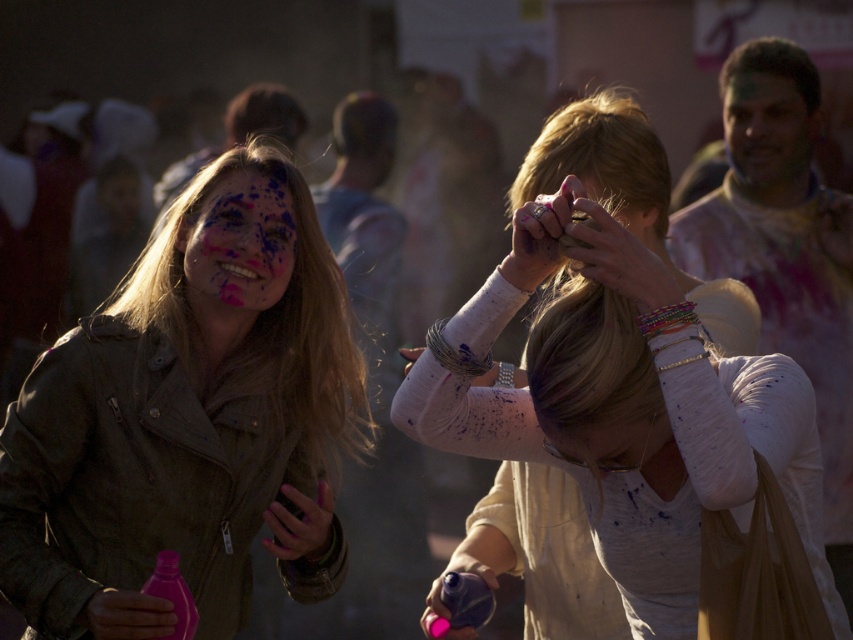
Does white textured sweater at center appear over painted skin at center?

Incorrect, white textured sweater at center is not positioned above painted skin at center.

Between white textured sweater at center and painted skin at center, which one appears on the right side from the viewer's perspective?

white textured sweater at center is more to the right.

Does point (537, 220) come in front of point (257, 291)?

Yes.

Find the location of a particular element. white textured sweater at center is located at coordinates (648, 468).

Who is positioned more to the left, matte green jacket at left or painted skin at center?

matte green jacket at left

How distant is matte green jacket at left from painted skin at center?

7.68 inches

What do you see at coordinates (189, 419) in the screenshot? The height and width of the screenshot is (640, 853). I see `matte green jacket at left` at bounding box center [189, 419].

Identify the location of matte green jacket at left. (189, 419).

Which of these two, painted skin at center or smooth skin face at upper right, stands taller?

With more height is smooth skin face at upper right.

Is painted skin at center shorter than smooth skin face at upper right?

Indeed, painted skin at center has a lesser height compared to smooth skin face at upper right.

This screenshot has height=640, width=853. Describe the element at coordinates (241, 241) in the screenshot. I see `painted skin at center` at that location.

The width and height of the screenshot is (853, 640). Identify the location of painted skin at center. pos(241,241).